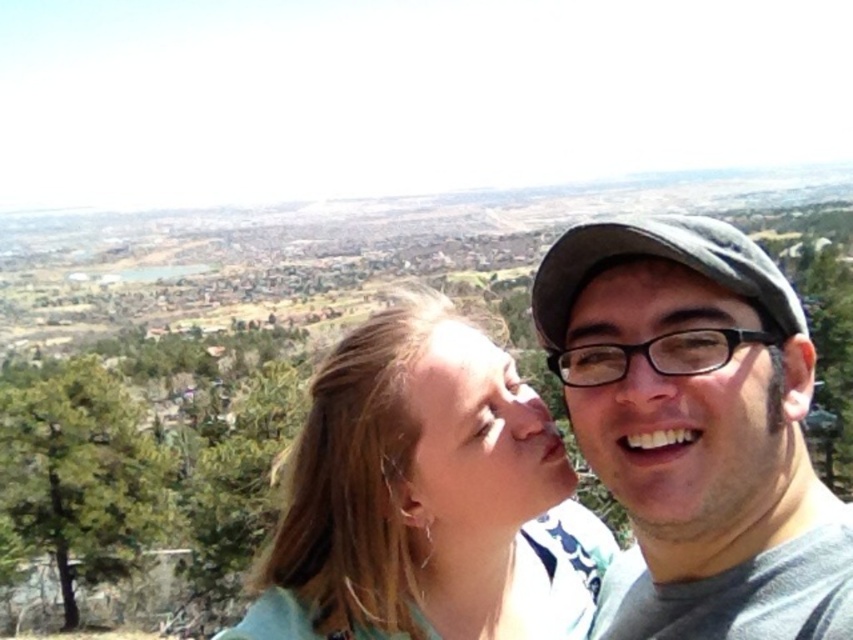
Does blonde hair at center have a larger size compared to smooth skin face at center?

Correct, blonde hair at center is larger in size than smooth skin face at center.

Is blonde hair at center to the right of smooth skin face at center from the viewer's perspective?

Incorrect, blonde hair at center is not on the right side of smooth skin face at center.

Locate an element on the screen. The image size is (853, 640). blonde hair at center is located at coordinates (427, 497).

Can you confirm if matte black glasses at center is positioned to the left of smooth skin face at center?

Incorrect, matte black glasses at center is not on the left side of smooth skin face at center.

Can you confirm if matte black glasses at center is taller than smooth skin face at center?

Correct, matte black glasses at center is much taller as smooth skin face at center.

Between point (706, 278) and point (550, 477), which one is positioned behind?

The point (550, 477) is more distant.

The width and height of the screenshot is (853, 640). Find the location of `matte black glasses at center`. matte black glasses at center is located at coordinates (693, 444).

Does blonde hair at center have a lesser height compared to matte black glasses at center?

Incorrect, blonde hair at center's height does not fall short of matte black glasses at center's.

Is blonde hair at center bigger than matte black glasses at center?

Yes, blonde hair at center is bigger than matte black glasses at center.

Who is more distant from viewer, (535, 506) or (728, 516)?

The point (535, 506) is more distant.

What are the coordinates of `blonde hair at center` in the screenshot? It's located at 427,497.